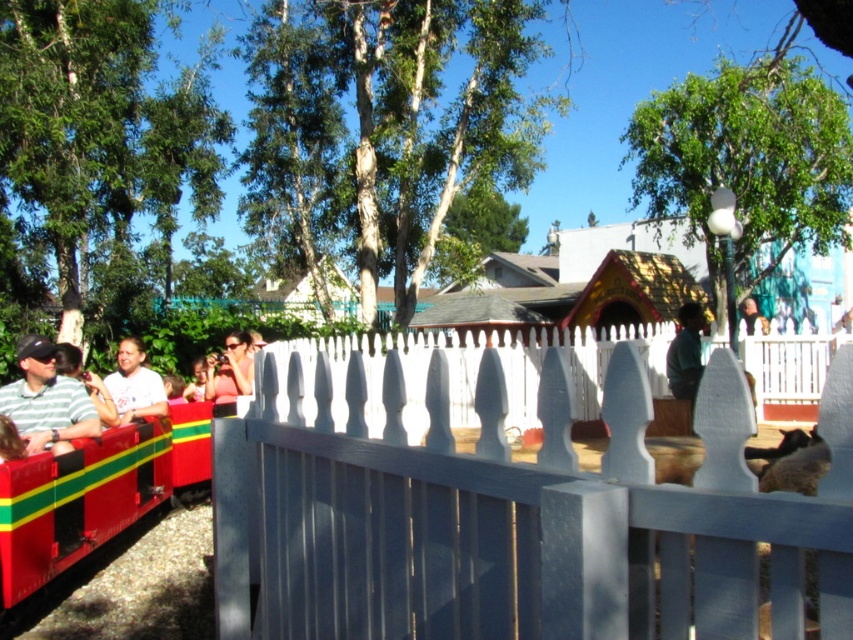
Question: Does striped green and white shirt at left have a greater width compared to smooth skin face at upper center?

Choices:
 (A) yes
 (B) no

Answer: (B)

Question: Among these objects, which one is farthest from the camera?

Choices:
 (A) striped green and white shirt at left
 (B) white painted picket fence at center
 (C) matte pink sunglasses at center
 (D) dark green shirt at center

Answer: (D)

Question: Is matte white shirt at center wider than matte pink sunglasses at center?

Choices:
 (A) yes
 (B) no

Answer: (B)

Question: Which point appears farthest from the camera in this image?

Choices:
 (A) (699, 332)
 (B) (233, 374)

Answer: (A)

Question: Considering the real-world distances, which object is farthest from the white painted picket fence at center?

Choices:
 (A) striped green and white shirt at left
 (B) smooth skin face at upper center
 (C) dark green shirt at center

Answer: (B)

Question: Is matte pink sunglasses at center further to the viewer compared to smooth skin face at upper center?

Choices:
 (A) yes
 (B) no

Answer: (B)